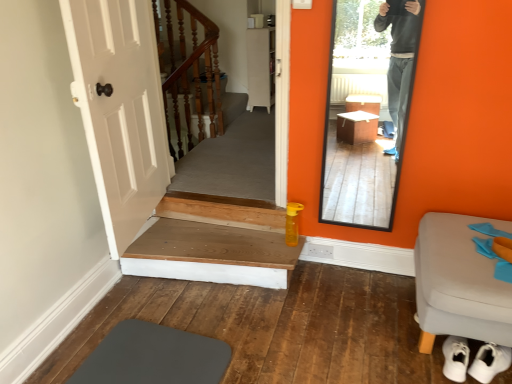
Locate an element on the screen. vacant space positioned to the left of white fabric stool at lower right is located at coordinates (354, 330).